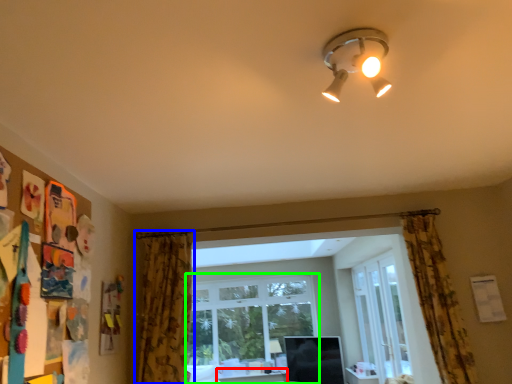
Question: Which is nearer to the table (highlighted by a red box)? curtain (highlighted by a blue box) or window (highlighted by a green box).

Choices:
 (A) curtain
 (B) window

Answer: (B)